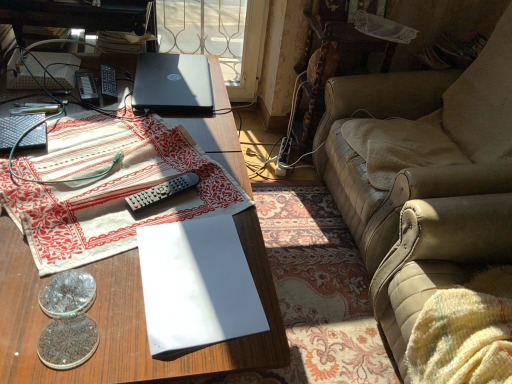
The width and height of the screenshot is (512, 384). In order to click on blank space to the left of black plastic remote control at center, the third remote control viewed from the front in this screenshot , I will do `click(53, 88)`.